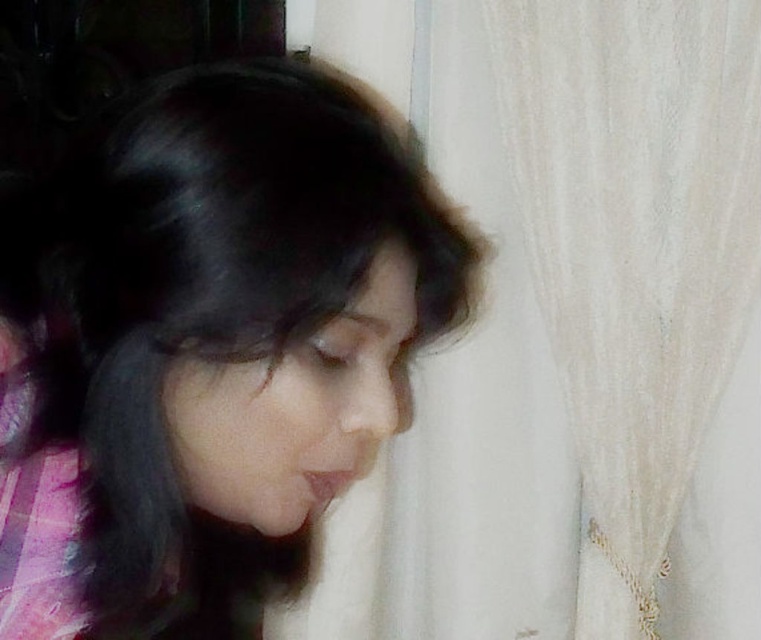
You are a photographer adjusting the lighting for a portrait. You notice the white sheer curtain at upper right and the smooth black hair at center. Which object is closer to the camera based on their positions?

The white sheer curtain at upper right is positioned over the smooth black hair at center, meaning it is closer to the camera.

You are a photographer adjusting the focus on your camera. You have two points in the image to focus on, point 1 at coordinates point [744,76] and point 2 at coordinates point [40,323]. Which point is closer to you?

Point [744,76] is further to the viewer than point [40,323], so point [40,323] is closer to you.